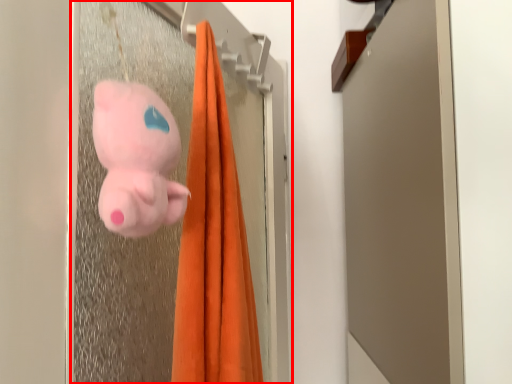
Question: From the image's perspective, where is screen door (annotated by the red box) located relative to toy?

Choices:
 (A) below
 (B) above

Answer: (A)